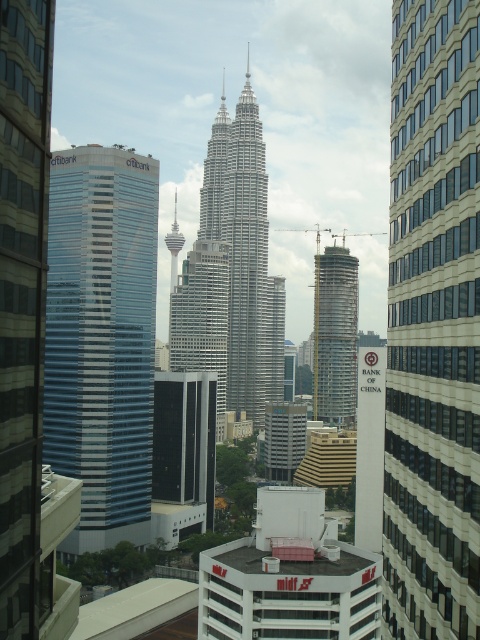
You are a drone operator tasked with capturing aerial footage of the urban skyline. You need to ensure that both the silver metallic twin towers at center and the sleek silver skyscraper at center are visible in the frame. Based on their positions, which one should you position higher in your camera view to include both effectively?

The silver metallic twin towers at center are located above the sleek silver skyscraper at center, so positioning the camera to focus higher on the silver metallic twin towers at center will ensure both structures are visible in the frame.

In the scene shown: You are a drone operator tasked with flying a drone between the silver metallic twin towers at center and the glassy silver skyscraper at center. The drone has a maximum flight distance of 20 meters. Can you safely fly the drone between them without exceeding its range?

The silver metallic twin towers at center is 20.43 meters away from the glassy silver skyscraper at center. Since the drone has a maximum flight distance of 20 meters, it cannot safely fly between them without exceeding its range.

You are a drone operator trying to deliver a package to the top of the silver metallic twin towers at center. Your drone has a maximum flight range of 500 meters. Given that the point at coordinates [231,275] is on the silver metallic twin towers at center, can you confirm if the drone can reach the top of the towers?

The point at coordinates [231,275] is on the silver metallic twin towers at center, but the exact distance from the drone to the top is not provided. Therefore, it is impossible to confirm if the drone can reach the top based on the given information.